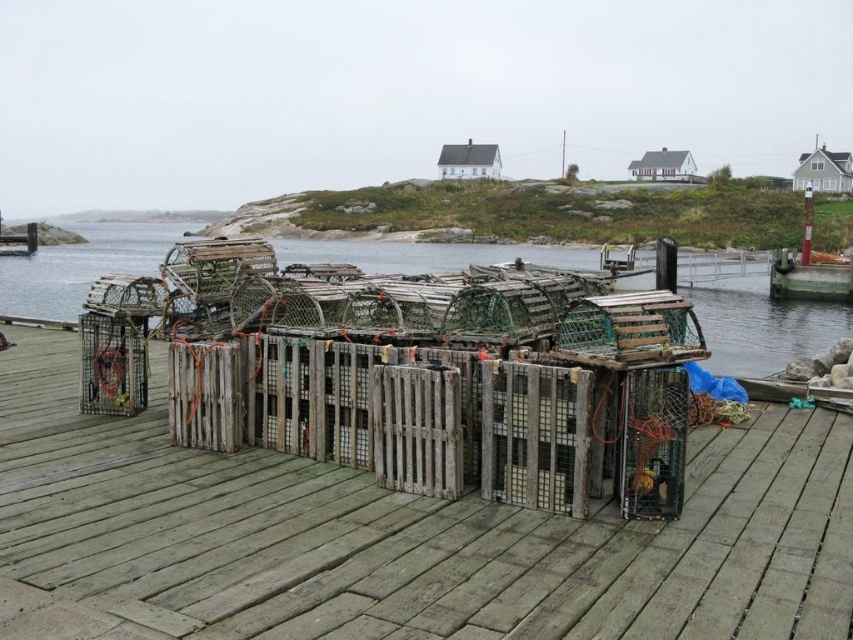
In the scene shown: You are standing on the wooden dock at lower right and want to move towards the weathered wood crates at center. In which direction should you walk?

You should walk to the left towards the weathered wood crates at center since they are located to the left of the wooden dock at lower right.

Consider the image. You are a delivery person trying to place a large package on the dock. The package is the size of the wooden crates at center. Can you fit it on the wooden dock at lower right without overlapping the dock?

The wooden crates at center is bigger than wooden dock at lower right, so the package cannot fit on the wooden dock at lower right without overlapping since it is larger than the dock.